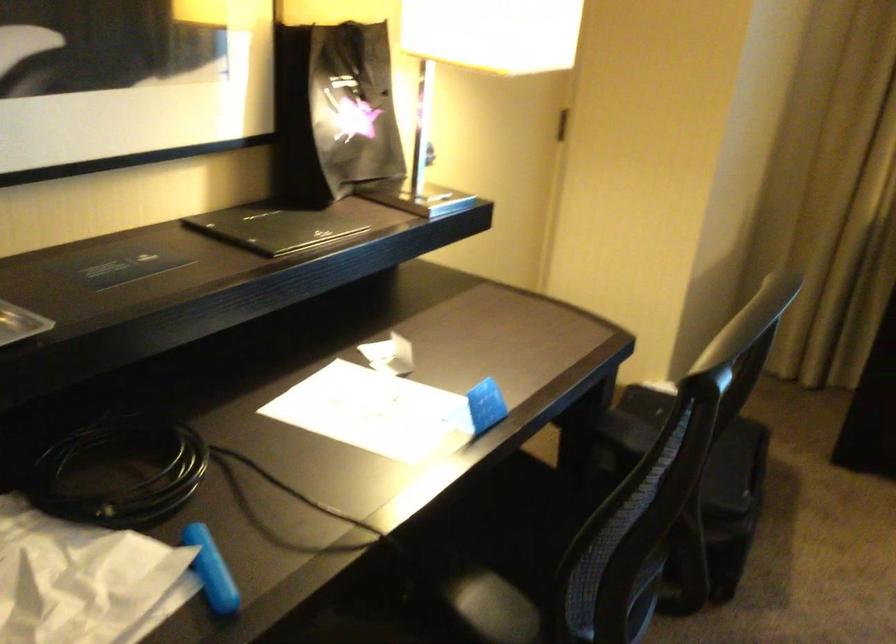
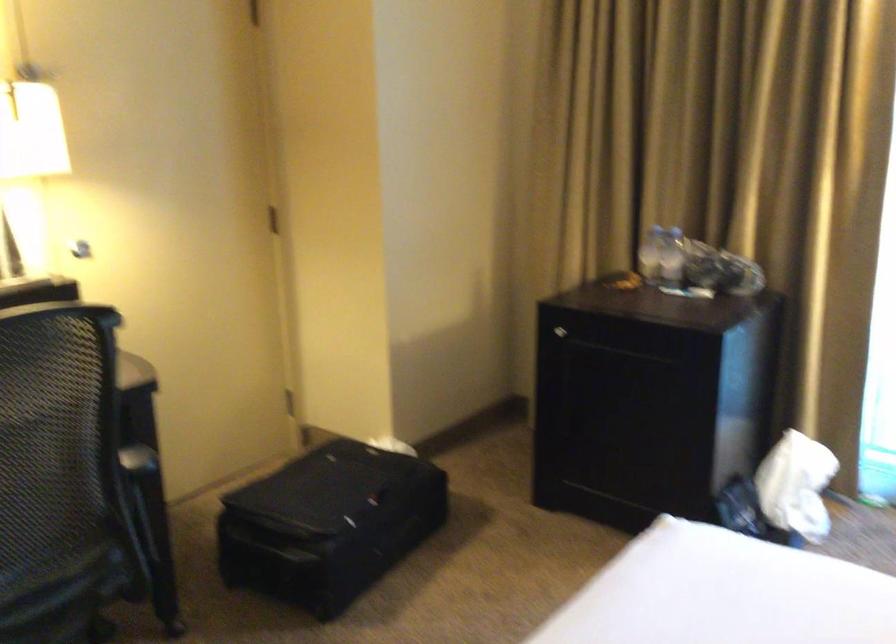
Question: In a continuous first-person perspective shot, in which direction is the camera moving?

Choices:
 (A) Left
 (B) Right
 (C) Forward
 (D) Backward

Answer: (B)